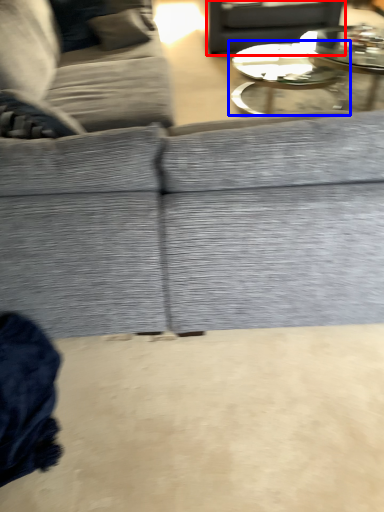
Question: Which of the following is the closest to the observer, gray (highlighted by a red box) or coffee table (highlighted by a blue box)?

Choices:
 (A) gray
 (B) coffee table

Answer: (B)